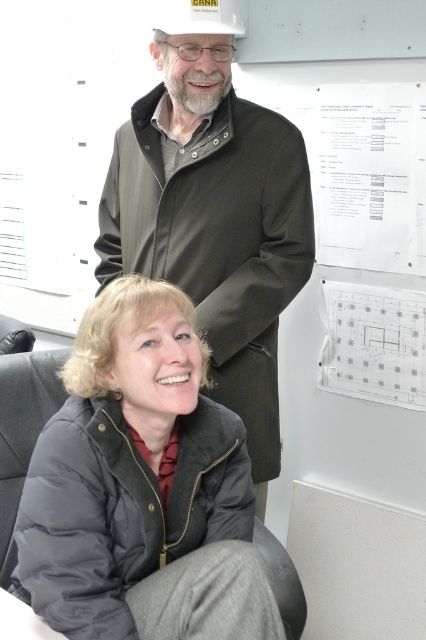
You are standing in an office and see a point marked at coordinates (141, 486). Which object is this point located on?

The point marked at coordinates (141, 486) is located on the dark gray puffer jacket at lower left.

You are an office worker who needs to place a new 100 cm wide poster on the wall. You see the dark gray puffer jacket at lower left and the transparent plastic poster at upper right. Can you fit the new poster between them without overlapping?

The dark gray puffer jacket at lower left and transparent plastic poster at upper right are 89.00 centimeters apart. Since the new poster is 100 cm wide, it cannot fit between them without overlapping as the distance is smaller than the poster width.